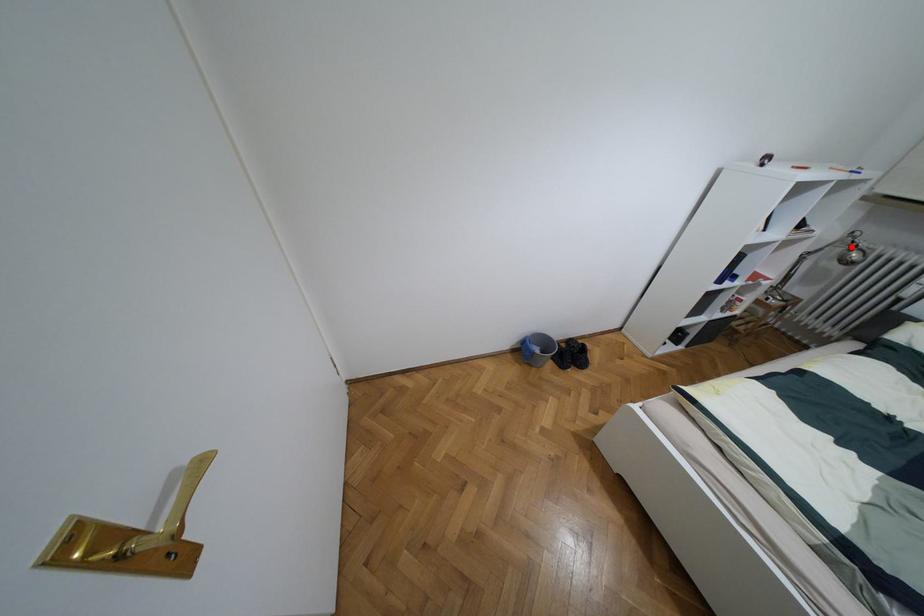
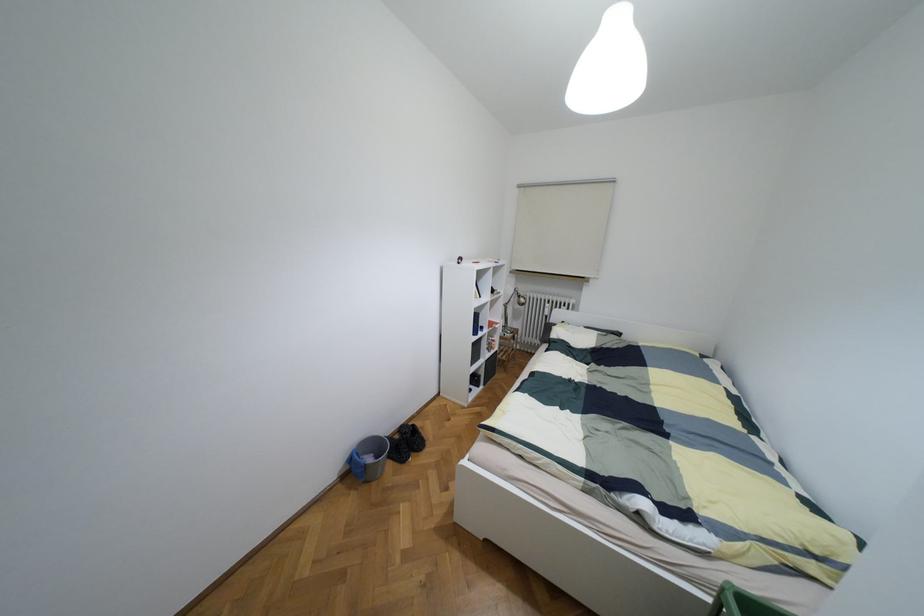
Question: I am providing you with two images of the same scene from different viewpoints. A red point is shown in image1. For the corresponding object point in image2, is it positioned nearer or farther from the camera?

Choices:
 (A) Nearer
 (B) Farther

Answer: (A)